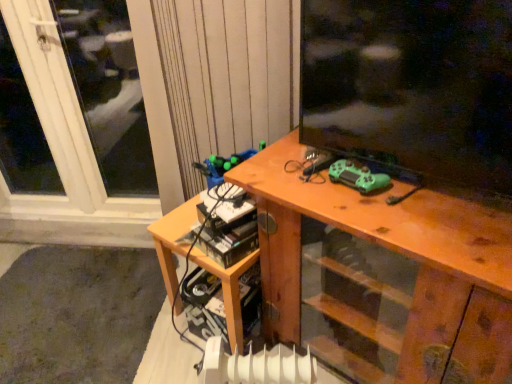
The height and width of the screenshot is (384, 512). Identify the location of empty space that is to the right of green matte game controller at center. (426, 197).